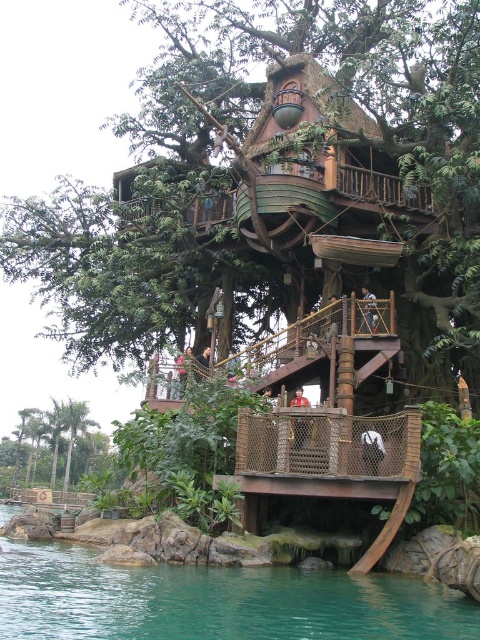
You are standing at the entrance of the treehouse and want to locate the teal glossy water at lower center. According to the coordinates provided, in which direction should you look to find it?

The teal glossy water at lower center is located at coordinates point (x=215, y=602), so you should look towards the lower center direction to find it.

You are standing on the wooden walkway of the treehouse and notice the teal glossy water at lower center and the green leafy palm trees at lower left. Which object is positioned higher from the ground?

The teal glossy water at lower center is positioned higher from the ground than the green leafy palm trees at lower left because the description states it is above them.

You are planning to set up a small boat in the teal glossy water at lower center. Considering the space available, will the boat fit comfortably without overcrowding the area compared to the green leafy palm trees at lower left?

The teal glossy water at lower center occupies less space than green leafy palm trees at lower left, so the boat may not have enough space to fit comfortably without overcrowding the area compared to the palm trees.